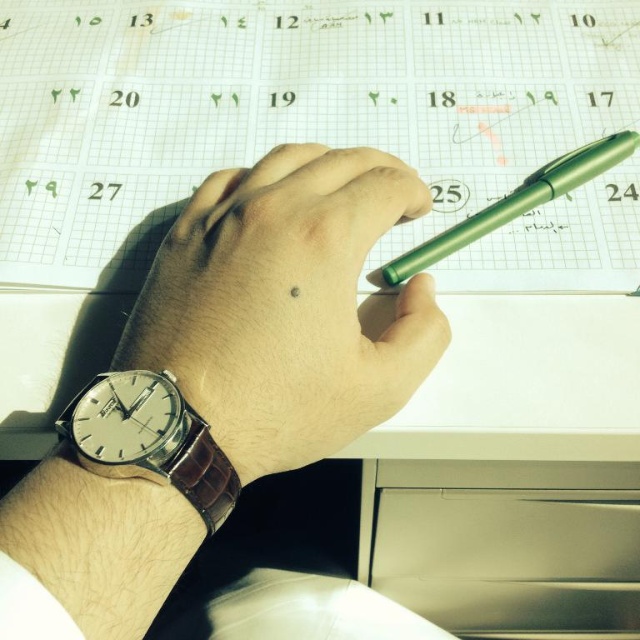
Measure the distance between point (156, 253) and camera.

Point (156, 253) and camera are 18.62 inches apart.

Image resolution: width=640 pixels, height=640 pixels. What do you see at coordinates (285, 305) in the screenshot?
I see `sleek leather watch at center` at bounding box center [285, 305].

Measure the distance between sleek leather watch at center and camera.

32.60 centimeters

Find the location of a particular element. Image resolution: width=640 pixels, height=640 pixels. sleek leather watch at center is located at coordinates (285, 305).

Who is shorter, metallic silver drawer at lower right or green metallic pen at upper right?

With less height is green metallic pen at upper right.

Is metallic silver drawer at lower right to the right of green metallic pen at upper right from the viewer's perspective?

Indeed, metallic silver drawer at lower right is positioned on the right side of green metallic pen at upper right.

Is point (554, 493) farther from viewer compared to point (486, 218)?

Yes, it is.

The image size is (640, 640). Find the location of `metallic silver drawer at lower right`. metallic silver drawer at lower right is located at coordinates (506, 544).

Is sleek leather watch at center above green metallic pen at upper right?

No.

Who is more distant from viewer, [273,321] or [397,262]?

Point [397,262]

Find the location of a particular element. The image size is (640, 640). sleek leather watch at center is located at coordinates (285, 305).